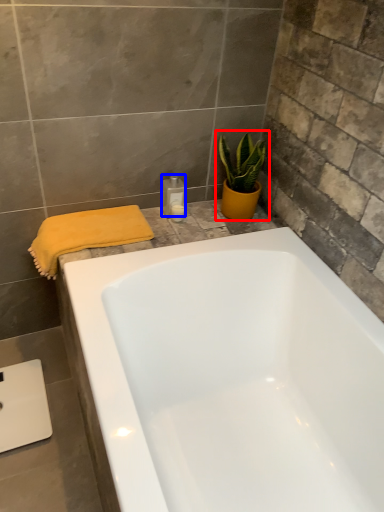
Question: Which point is further to the camera, houseplant (highlighted by a red box) or toiletry (highlighted by a blue box)?

Choices:
 (A) houseplant
 (B) toiletry

Answer: (B)